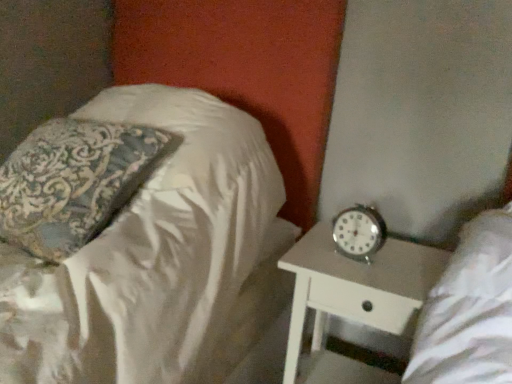
Question: Can you confirm if white glossy nightstand at lower right is bigger than silky white pillow at upper left?

Choices:
 (A) yes
 (B) no

Answer: (A)

Question: Can you see white glossy nightstand at lower right touching silky white pillow at upper left?

Choices:
 (A) no
 (B) yes

Answer: (A)

Question: Does white glossy nightstand at lower right turn towards silky white pillow at upper left?

Choices:
 (A) yes
 (B) no

Answer: (B)

Question: Is white glossy nightstand at lower right not inside silky white pillow at upper left?

Choices:
 (A) no
 (B) yes

Answer: (B)

Question: Does white glossy nightstand at lower right have a lesser width compared to silky white pillow at upper left?

Choices:
 (A) yes
 (B) no

Answer: (B)

Question: Does point 352,253 appear closer or farther from the camera than point 320,284?

Choices:
 (A) closer
 (B) farther

Answer: (B)

Question: In terms of width, does metallic silver clock at right look wider or thinner when compared to white glossy nightstand at lower right?

Choices:
 (A) wide
 (B) thin

Answer: (B)

Question: Do you think metallic silver clock at right is within white glossy nightstand at lower right, or outside of it?

Choices:
 (A) outside
 (B) inside

Answer: (A)

Question: Would you say metallic silver clock at right is to the left or to the right of white glossy nightstand at lower right in the picture?

Choices:
 (A) left
 (B) right

Answer: (A)

Question: In terms of size, does silky white pillow at upper left appear bigger or smaller than metallic silver clock at right?

Choices:
 (A) small
 (B) big

Answer: (B)

Question: Is silky white pillow at upper left wider or thinner than metallic silver clock at right?

Choices:
 (A) wide
 (B) thin

Answer: (A)

Question: Is silky white pillow at upper left to the left or to the right of metallic silver clock at right in the image?

Choices:
 (A) left
 (B) right

Answer: (A)

Question: Is silky white pillow at upper left spatially inside metallic silver clock at right, or outside of it?

Choices:
 (A) inside
 (B) outside

Answer: (B)

Question: Considering the positions of white glossy nightstand at lower right and silky white pillow at upper left in the image, is white glossy nightstand at lower right taller or shorter than silky white pillow at upper left?

Choices:
 (A) tall
 (B) short

Answer: (A)

Question: From a real-world perspective, is white glossy nightstand at lower right above or below silky white pillow at upper left?

Choices:
 (A) above
 (B) below

Answer: (B)